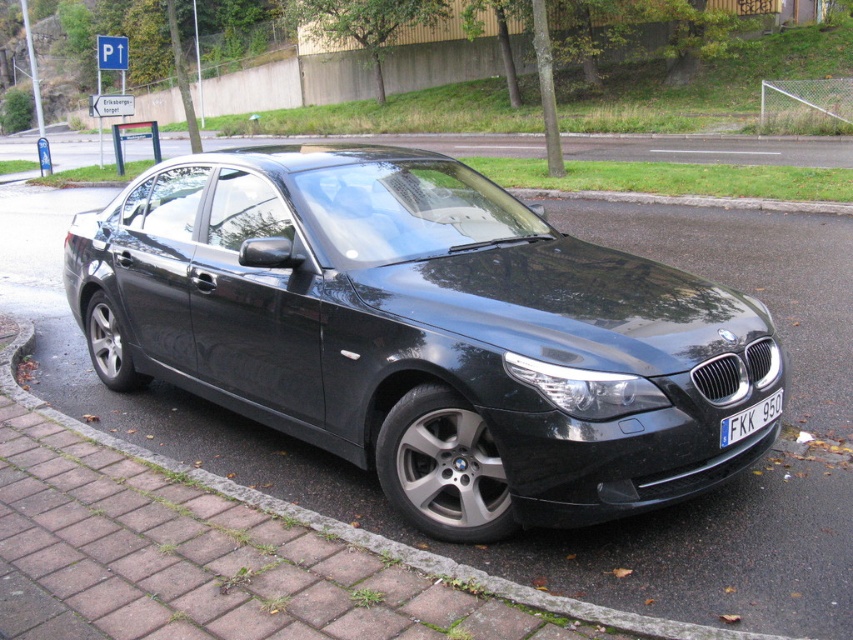
Question: Which point is closer to the camera taking this photo?

Choices:
 (A) (180, 212)
 (B) (759, 403)

Answer: (B)

Question: Is glossy black car at center below white plastic license plate at front?

Choices:
 (A) no
 (B) yes

Answer: (A)

Question: Which point is closer to the camera?

Choices:
 (A) (225, 490)
 (B) (263, 184)

Answer: (A)

Question: Can you confirm if glossy black car at center is positioned to the right of white plastic license plate at front?

Choices:
 (A) no
 (B) yes

Answer: (A)

Question: Is glossy black car at center thinner than brick pavement at lower left?

Choices:
 (A) no
 (B) yes

Answer: (A)

Question: Estimate the real-world distances between objects in this image. Which object is farther from the white plastic license plate at front?

Choices:
 (A) brick pavement at lower left
 (B) glossy black car at center

Answer: (B)